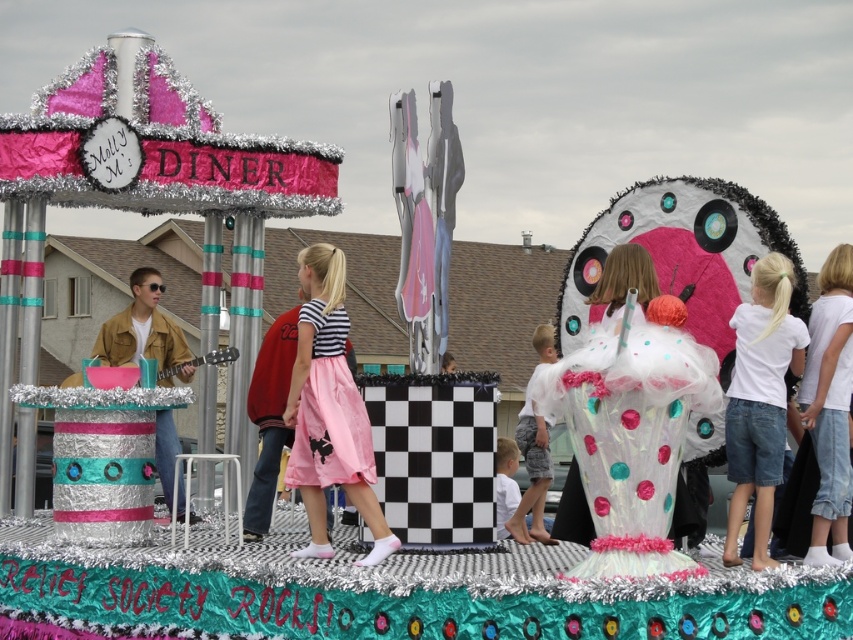
You are a photographer trying to capture a clear photo of the white cotton shirt at right and the pink satin skirt at center. However, you notice that one of them is blocking the other. Which one is obstructing the view of the other?

The white cotton shirt at right is behind the pink satin skirt at center, so the pink satin skirt at center is obstructing the view of the white cotton shirt at right.

You are a photographer at the parade and want to capture both the translucent tulle dress at center and the white cotton shirt at center in the same frame. Which one should you focus on first to ensure they are both in the shot?

The translucent tulle dress at center is positioned on the right side of white cotton shirt at center, so you should focus on the white cotton shirt at center first to ensure both are in the frame.

You are standing at the edge of the float and want to hand a ribbon to the person in the translucent tulle dress at center. According to the coordinates provided, where should you aim to place the ribbon?

The translucent tulle dress at center is located at coordinates point (625,276), so you should aim to place the ribbon at that position.